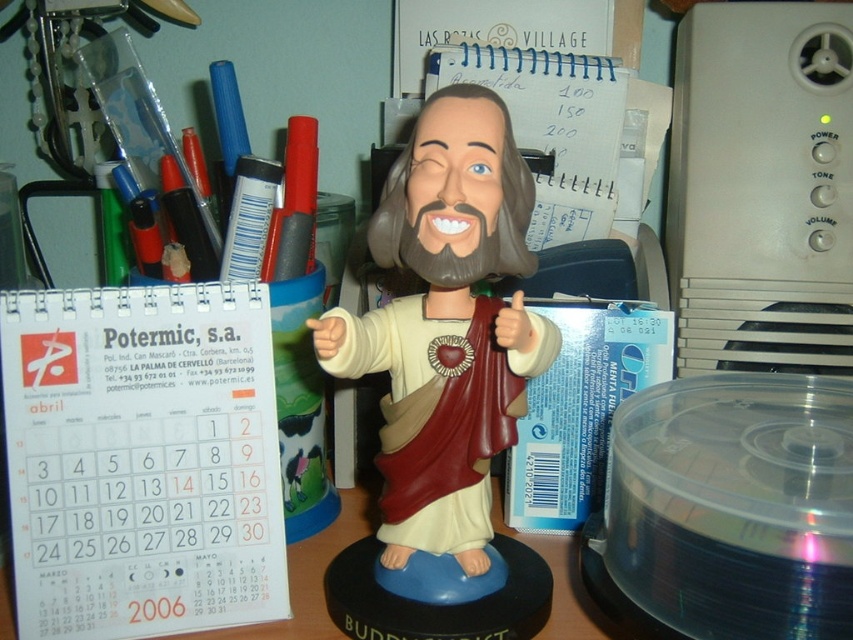
From the picture: Who is taller, white paper calendar at left or matte plastic bobblehead at center?

matte plastic bobblehead at center

Based on the photo, which is below, white paper calendar at left or matte plastic bobblehead at center?

white paper calendar at left is below.

Between point (125, 536) and point (440, 113), which one is positioned behind?

The point (125, 536) is behind.

Locate an element on the screen. The image size is (853, 640). white paper calendar at left is located at coordinates (142, 460).

Between white paper calendar at left and white paper calendar at center, which one is positioned higher?

white paper calendar at center

In the scene shown: Which is below, white paper calendar at left or white paper calendar at center?

Positioned lower is white paper calendar at left.

Identify the location of white paper calendar at left. This screenshot has height=640, width=853. (142, 460).

Which is above, matte plastic bobblehead at center or white paper calendar at center?

white paper calendar at center is higher up.

Where is `matte plastic bobblehead at center`? This screenshot has height=640, width=853. matte plastic bobblehead at center is located at coordinates (445, 326).

Locate an element on the screen. matte plastic bobblehead at center is located at coordinates (445, 326).